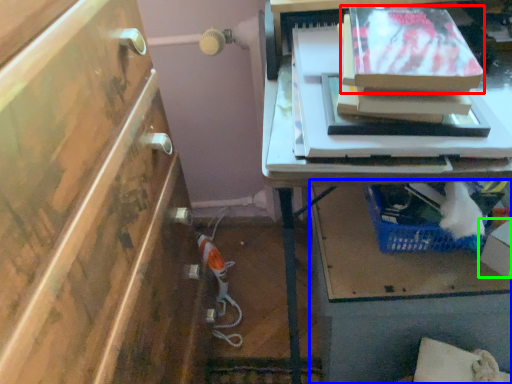
Question: Considering the real-world distances, which object is farthest from storage box (highlighted by a red box)? vanity (highlighted by a blue box) or box (highlighted by a green box)?

Choices:
 (A) vanity
 (B) box

Answer: (A)